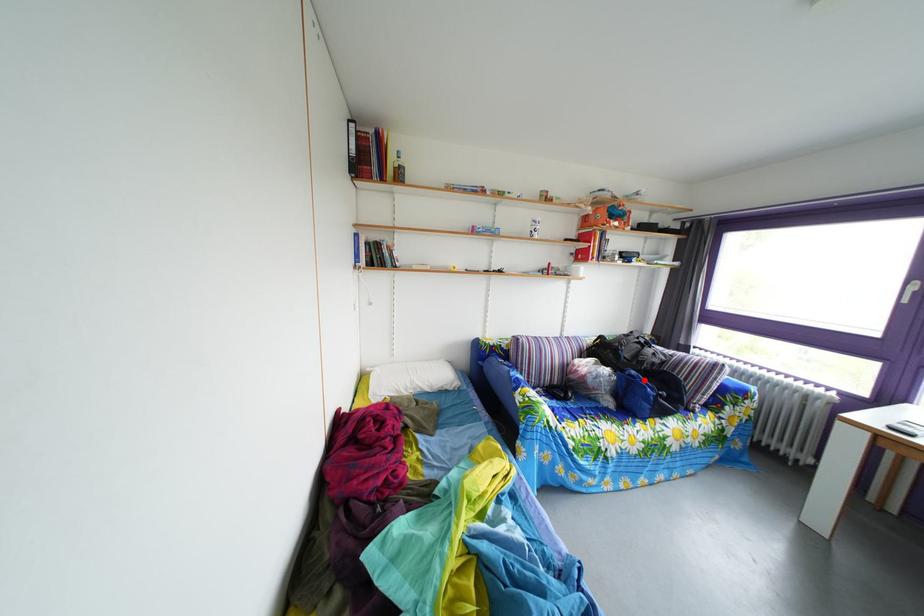
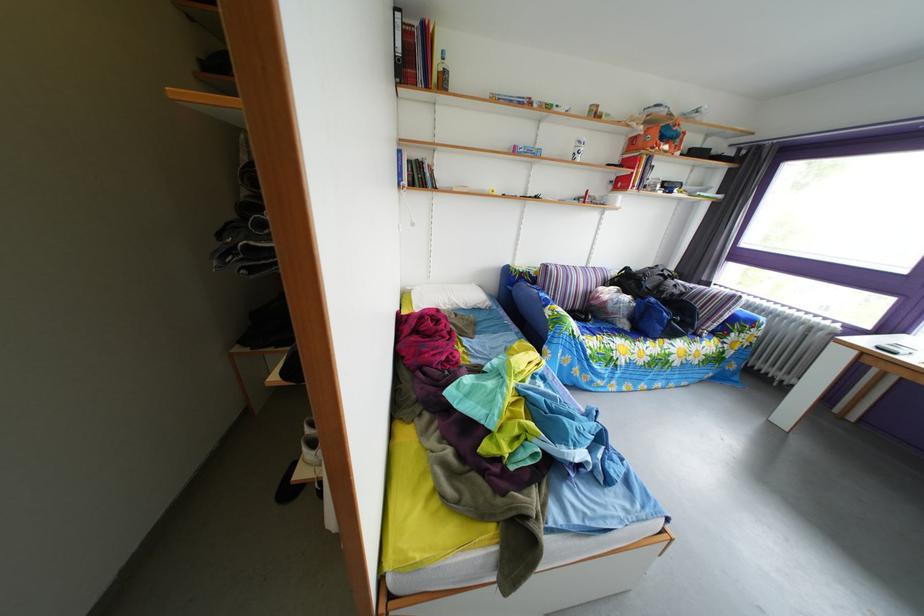
Locate, in the second image, the point that corresponds to the highlighted location in the first image.

(663, 307)